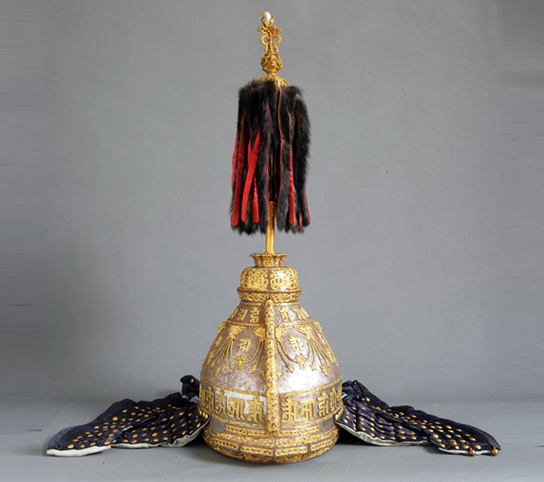
You are a GUI agent. You are given a task and a screenshot of the screen. Output one action in this format:
    pyautogui.click(x=<x>, y=<y>)
    Task: Click on the scrollwork
    The height and width of the screenshot is (482, 544).
    Given the screenshot: What is the action you would take?
    pyautogui.click(x=247, y=355)